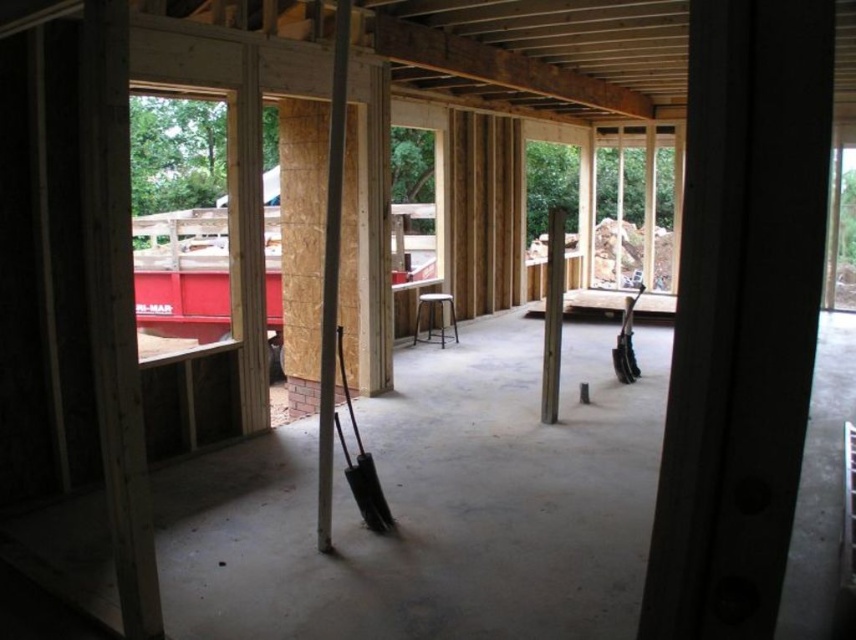
Question: Among these points, which one is nearest to the camera?

Choices:
 (A) (550, 420)
 (B) (378, 512)

Answer: (B)

Question: Which object appears closest to the camera in this image?

Choices:
 (A) smooth wood pillar at center
 (B) smooth wood beam at center
 (C) black plastic shovel at center

Answer: (B)

Question: Is smooth wood pillar at center to the right of black plastic shovel at right from the viewer's perspective?

Choices:
 (A) no
 (B) yes

Answer: (A)

Question: Can you confirm if black plastic shovel at center is positioned to the right of black plastic shovel at right?

Choices:
 (A) no
 (B) yes

Answer: (A)

Question: Does black plastic shovel at center appear under black plastic shovel at right?

Choices:
 (A) yes
 (B) no

Answer: (A)

Question: Which of the following is the closest to the observer?

Choices:
 (A) black plastic shovel at right
 (B) black plastic shovel at center

Answer: (B)